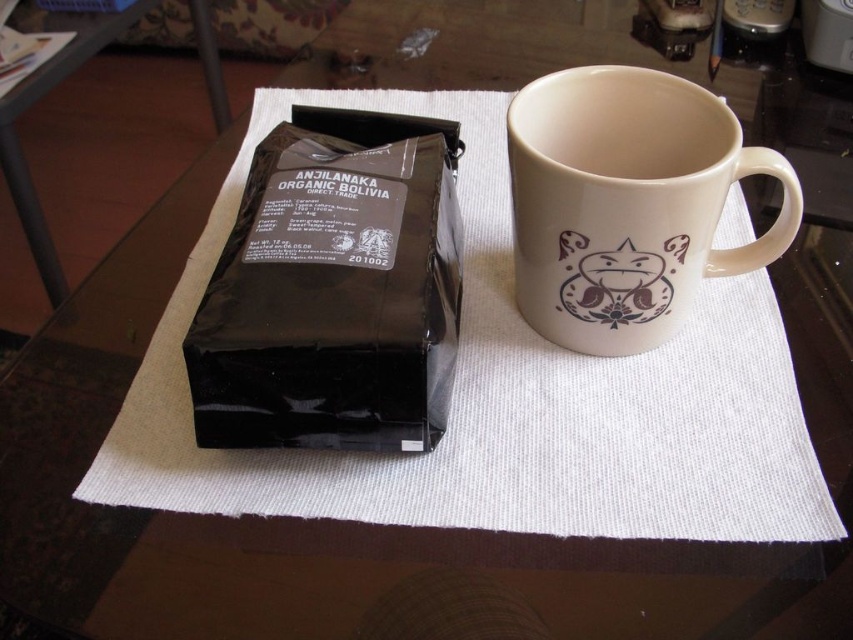
Question: Is black matte bag at left bigger than matte ceramic mug at upper right?

Choices:
 (A) yes
 (B) no

Answer: (A)

Question: Does black matte bag at left come in front of matte ceramic mug at upper right?

Choices:
 (A) no
 (B) yes

Answer: (B)

Question: Is black matte bag at left thinner than matte ceramic mug at upper right?

Choices:
 (A) yes
 (B) no

Answer: (A)

Question: Which point is closer to the camera?

Choices:
 (A) black matte bag at left
 (B) matte ceramic mug at upper right

Answer: (A)